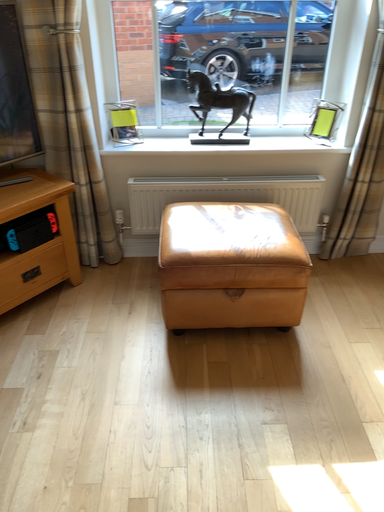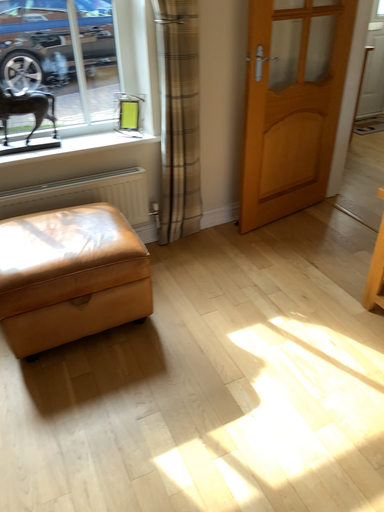
Question: How did the camera likely rotate when shooting the video?

Choices:
 (A) rotated left
 (B) rotated right

Answer: (B)